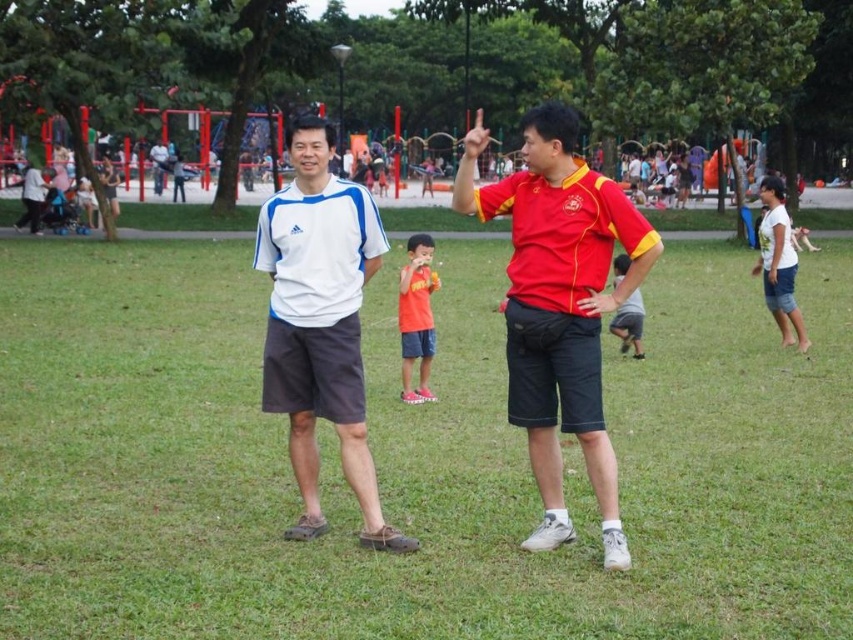
Question: Estimate the real-world distances between objects in this image. Which object is farther from the orange matte shirt at center?

Choices:
 (A) matte red shirt at center
 (B) white matte shirt at center
 (C) matte white shorts at center
 (D) gray cotton shorts at center

Answer: (C)

Question: Which object appears farthest from the camera in this image?

Choices:
 (A) white matte shirt at center
 (B) matte red shirt at center

Answer: (A)

Question: Is white cotton shirt at right wider than orange matte shirt at center?

Choices:
 (A) yes
 (B) no

Answer: (A)

Question: Can you confirm if matte white shorts at center is positioned to the right of orange matte shirt at center?

Choices:
 (A) no
 (B) yes

Answer: (B)

Question: Which of these objects is positioned farthest from the matte white shorts at center?

Choices:
 (A) gray cotton shorts at center
 (B) white cotton shirt at right
 (C) white matte shirt at center

Answer: (C)

Question: In this image, where is matte white shorts at center located relative to matte red shirt at center?

Choices:
 (A) right
 (B) left

Answer: (B)